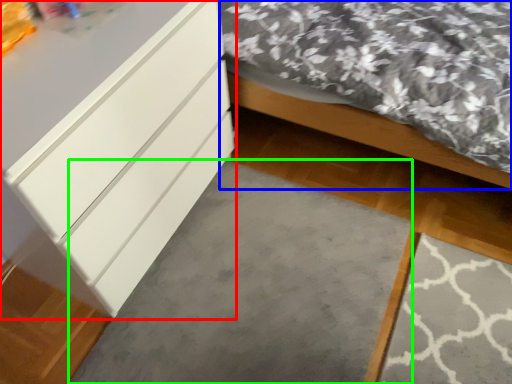
Question: Which object is positioned farthest from chest of drawers (highlighted by a red box)? Select from bed (highlighted by a blue box) and concrete (highlighted by a green box).

Choices:
 (A) bed
 (B) concrete

Answer: (A)